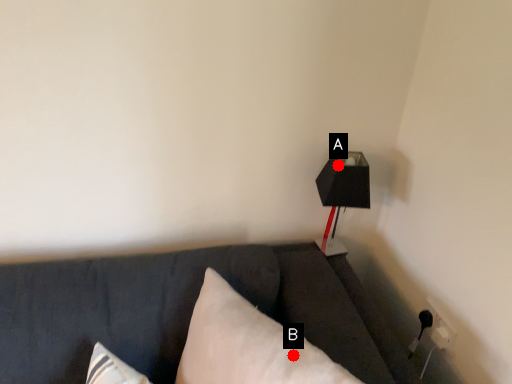
Question: Two points are circled on the image, labeled by A and B beside each circle. Which point is closer to the camera taking this photo?

Choices:
 (A) A is closer
 (B) B is closer

Answer: (B)